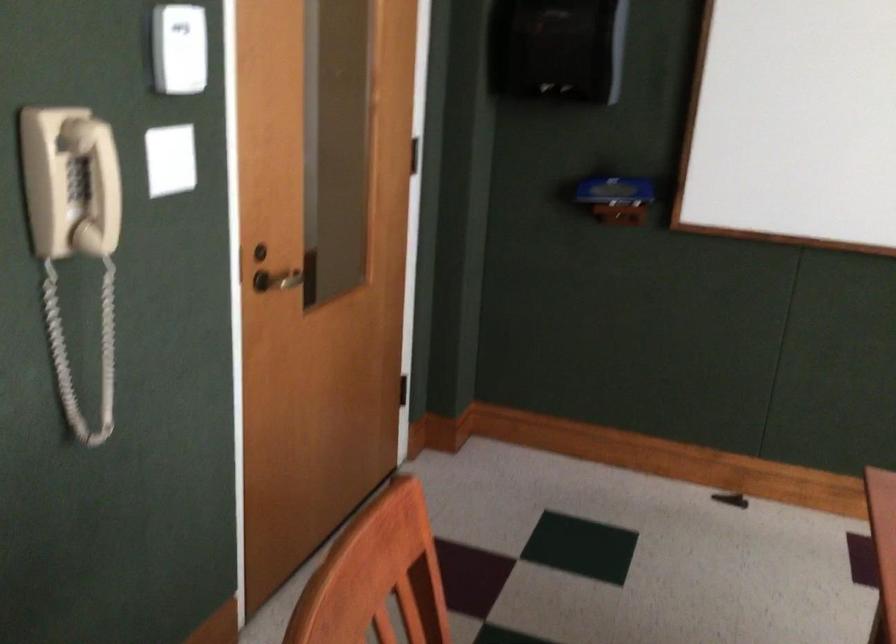
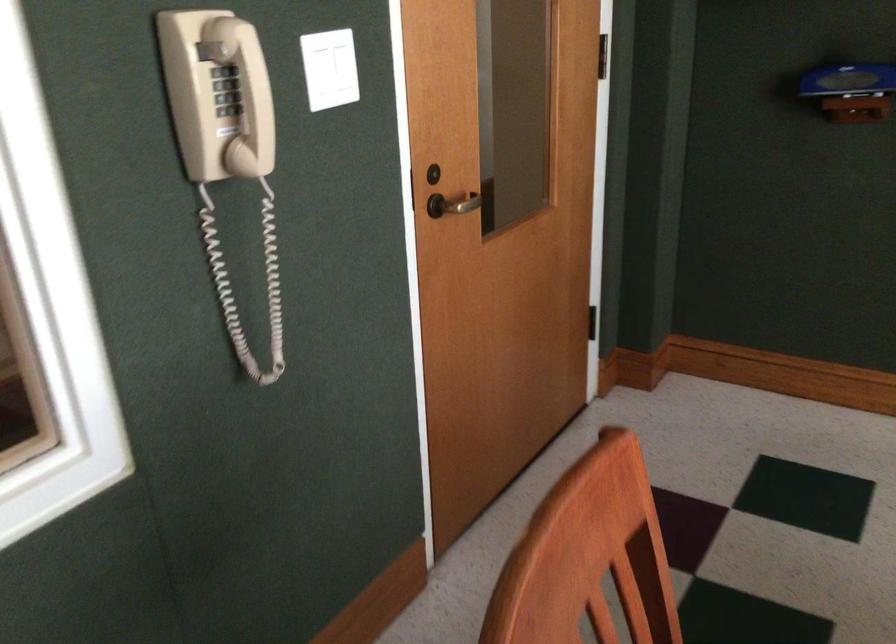
The point at (92, 192) is marked in the first image. Where is the corresponding point in the second image?

(226, 90)